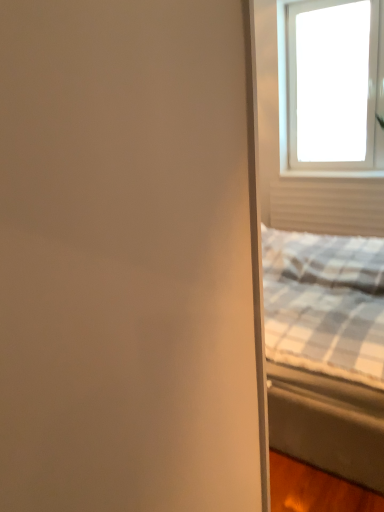
In order to face transparent glass window at upper right, should I rotate leftwards or rightwards?

To face it directly, rotate right by 18.844 degrees.

Identify the location of transparent glass window at upper right. This screenshot has width=384, height=512. (329, 85).

What is the approximate height of transparent glass window at upper right?

transparent glass window at upper right is 4.71 feet in height.

Describe the element at coordinates (329, 85) in the screenshot. I see `transparent glass window at upper right` at that location.

The height and width of the screenshot is (512, 384). Find the location of `transparent glass window at upper right`. transparent glass window at upper right is located at coordinates (329, 85).